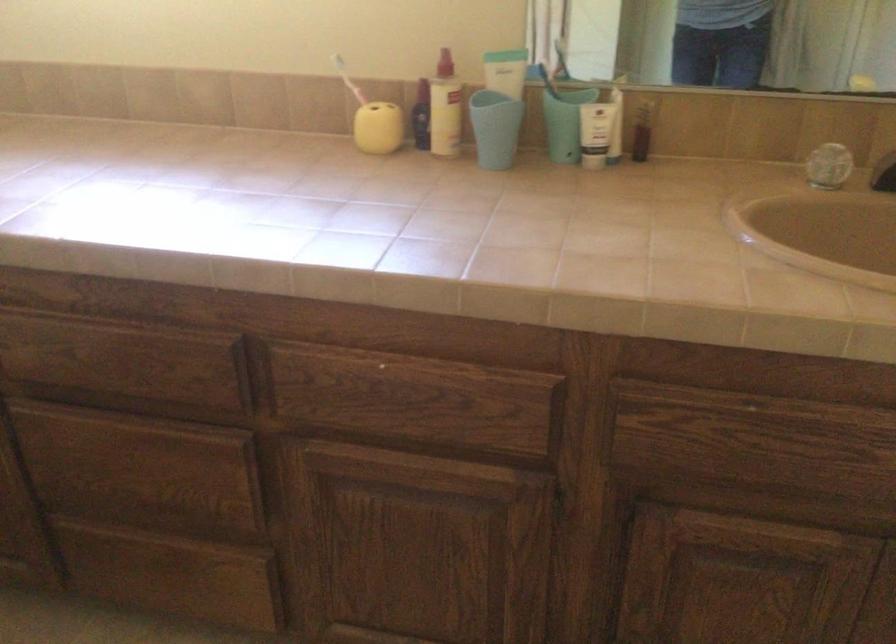
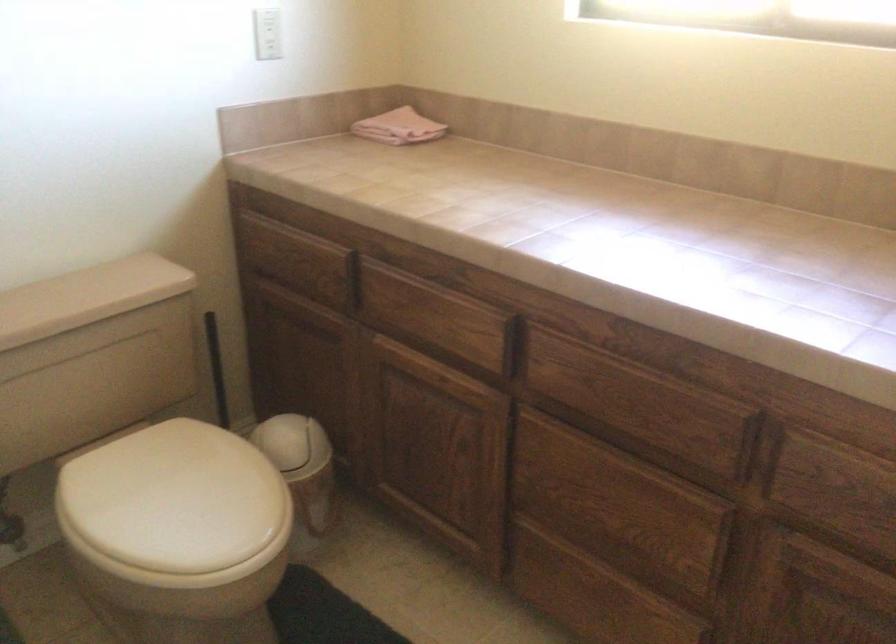
Where in the second image is the point corresponding to pixel 134 371 from the first image?

(643, 408)